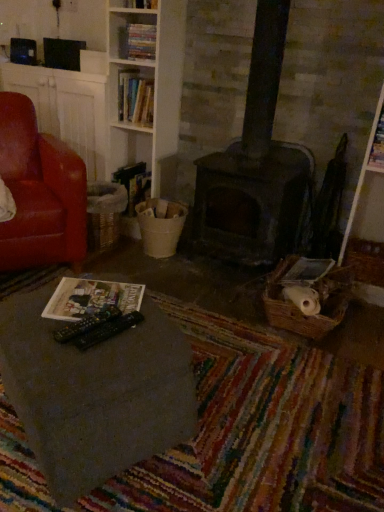
Identify the location of vacant point above dark gray stone fireplace at center (from a real-world perspective). (291, 137).